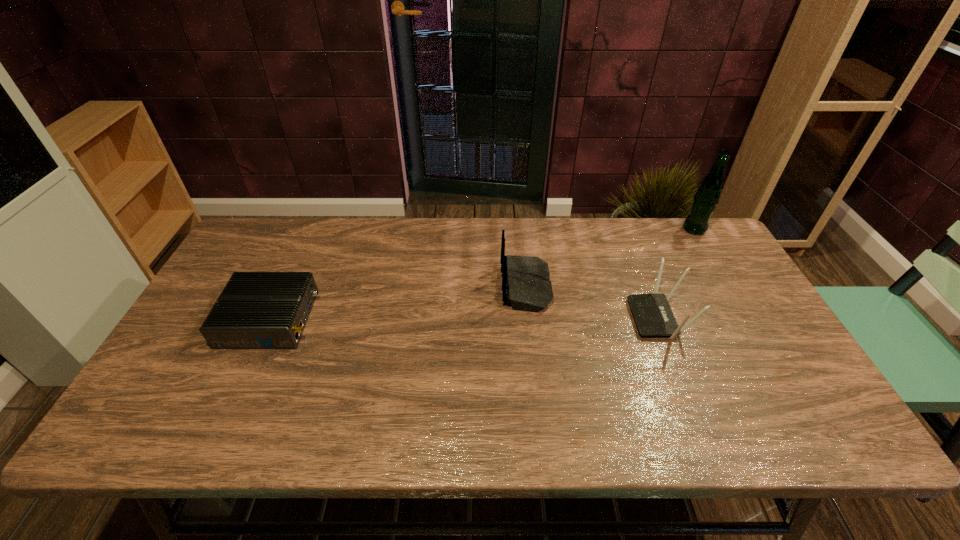
I want to click on router that can be found as the closest to the rightmost router, so click(526, 286).

At what (x,y) coordinates should I click in order to perform the action: click on vacant space that satisfies the following two spatial constraints: 1. on the front side of the tallest object; 2. on the back panel of the leftmost router. Please return your answer as a coordinate pair (x, y). The height and width of the screenshot is (540, 960). Looking at the image, I should click on (747, 319).

I want to click on vacant area in the image that satisfies the following two spatial constraints: 1. on the front side of the farthest object; 2. on the back of the third object from right to left, so click(729, 287).